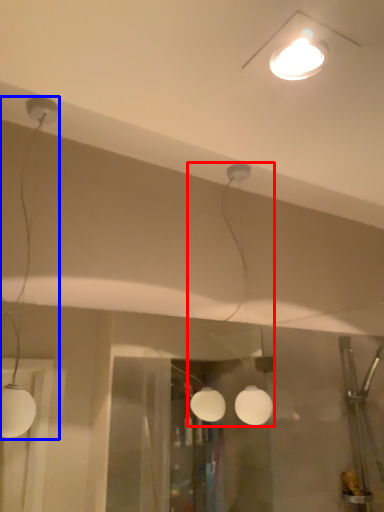
Question: Which of the following is the farthest to the observer, lamp (highlighted by a red box) or lamp (highlighted by a blue box)?

Choices:
 (A) lamp
 (B) lamp

Answer: (A)